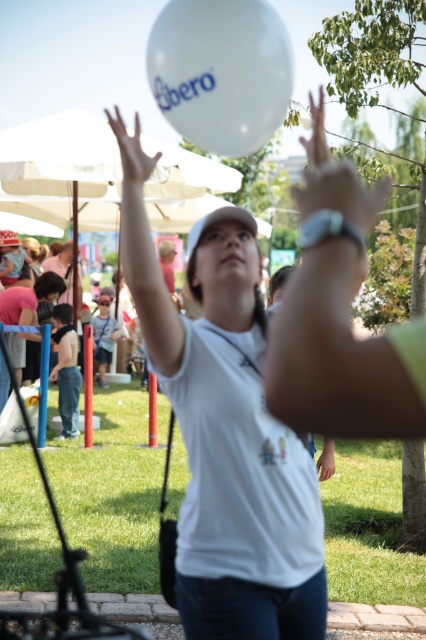
Question: Which object is positioned farthest from the white matte balloon at upper center?

Choices:
 (A) white matte balloon at center
 (B) matte pink shirt at lower left

Answer: (B)

Question: Is matte pink shirt at lower left bigger than white matte balloon at upper center?

Choices:
 (A) no
 (B) yes

Answer: (B)

Question: Is matte pink shirt at lower left to the left of white matte balloon at upper center from the viewer's perspective?

Choices:
 (A) yes
 (B) no

Answer: (A)

Question: Is white matte balloon at center positioned in front of white matte balloon at upper center?

Choices:
 (A) yes
 (B) no

Answer: (B)

Question: Which point appears farthest from the camera in this image?

Choices:
 (A) (0, 410)
 (B) (138, 228)

Answer: (A)

Question: Which of the following is the closest to the observer?

Choices:
 (A) matte pink shirt at lower left
 (B) white matte balloon at upper center

Answer: (B)